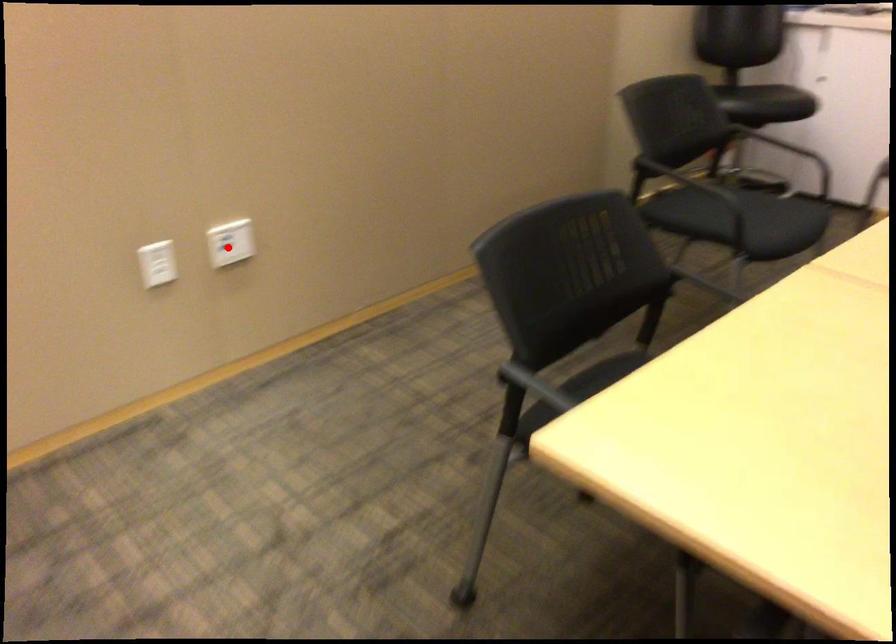
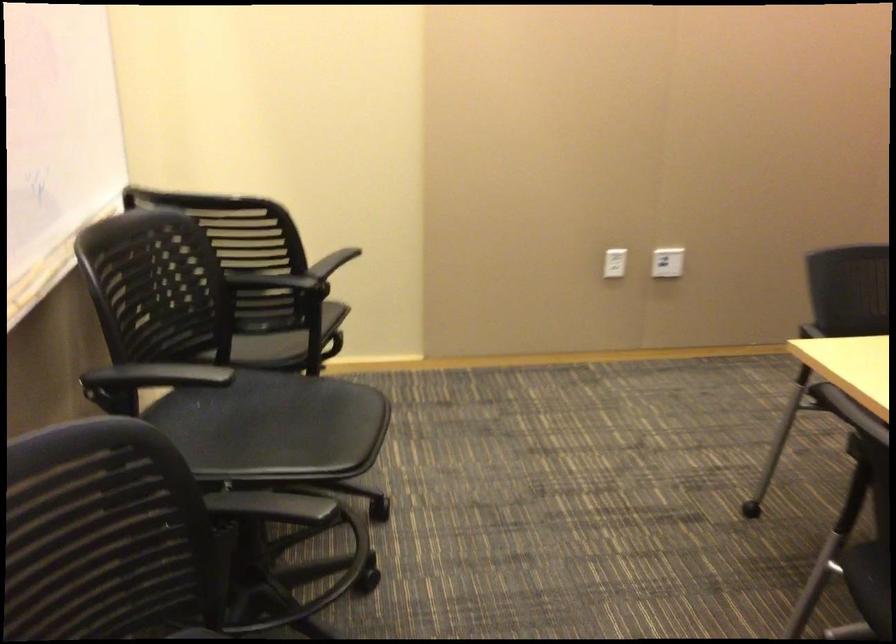
In the second image, find the point that corresponds to the highlighted location in the first image.

(667, 261)